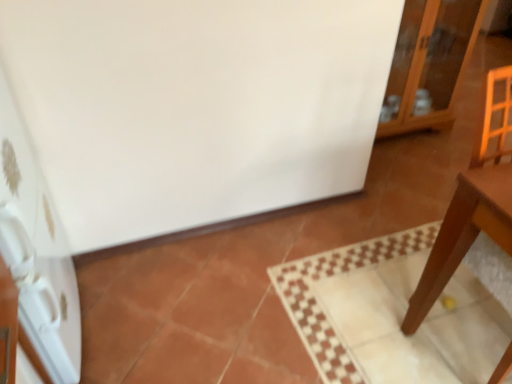
Image resolution: width=512 pixels, height=384 pixels. Describe the element at coordinates (37, 251) in the screenshot. I see `white glossy refrigerator at left` at that location.

The width and height of the screenshot is (512, 384). Identify the location of white glossy refrigerator at left. (37, 251).

In order to face white glossy refrigerator at left, should I rotate leftwards or rightwards?

To face it directly, rotate left by 30.622 degrees.

This screenshot has width=512, height=384. Describe the element at coordinates (429, 64) in the screenshot. I see `glossy wood cabinet at upper right` at that location.

This screenshot has height=384, width=512. In order to click on glossy wood cabinet at upper right in this screenshot , I will do `click(429, 64)`.

Image resolution: width=512 pixels, height=384 pixels. Identify the location of white glossy refrigerator at left. (37, 251).

In the image, is glossy wood cabinet at upper right on the left side or the right side of white glossy refrigerator at left?

Clearly, glossy wood cabinet at upper right is on the right of white glossy refrigerator at left in the image.

Considering the relative positions of glossy wood cabinet at upper right and white glossy refrigerator at left in the image provided, is glossy wood cabinet at upper right in front of white glossy refrigerator at left?

No.

Which is in front, point (446, 95) or point (36, 328)?

The point (36, 328) is more forward.

From the image's perspective, would you say glossy wood cabinet at upper right is shown under white glossy refrigerator at left?

No, from the image's perspective, glossy wood cabinet at upper right is not below white glossy refrigerator at left.

From a real-world perspective, is glossy wood cabinet at upper right under white glossy refrigerator at left?

Yes, from a real-world perspective, glossy wood cabinet at upper right is under white glossy refrigerator at left.

Consider the image. Considering the sizes of objects glossy wood cabinet at upper right and white glossy refrigerator at left in the image provided, who is thinner, glossy wood cabinet at upper right or white glossy refrigerator at left?

white glossy refrigerator at left.

Between glossy wood cabinet at upper right and white glossy refrigerator at left, which one has more height?

white glossy refrigerator at left.

Which of these two, glossy wood cabinet at upper right or white glossy refrigerator at left, is smaller?

glossy wood cabinet at upper right.

Would you say glossy wood cabinet at upper right is outside white glossy refrigerator at left?

glossy wood cabinet at upper right is positioned outside white glossy refrigerator at left.

Is there a large distance between glossy wood cabinet at upper right and white glossy refrigerator at left?

glossy wood cabinet at upper right is far away from white glossy refrigerator at left.

Is glossy wood cabinet at upper right aimed at white glossy refrigerator at left?

No, glossy wood cabinet at upper right is not turned towards white glossy refrigerator at left.

How different are the orientations of glossy wood cabinet at upper right and white glossy refrigerator at left in degrees?

glossy wood cabinet at upper right and white glossy refrigerator at left are facing 90 degrees away from each other.

The width and height of the screenshot is (512, 384). I want to click on appliance in front of the glossy wood cabinet at upper right, so coord(37,251).

Considering the positions of objects white glossy refrigerator at left and glossy wood cabinet at upper right in the image provided, who is more to the right, white glossy refrigerator at left or glossy wood cabinet at upper right?

Positioned to the right is glossy wood cabinet at upper right.

Considering the positions of objects white glossy refrigerator at left and glossy wood cabinet at upper right in the image provided, who is behind, white glossy refrigerator at left or glossy wood cabinet at upper right?

glossy wood cabinet at upper right is behind.

Which is nearer, (24, 150) or (461, 13)?

Point (24, 150) is closer to the camera than point (461, 13).

From the image's perspective, is white glossy refrigerator at left located above glossy wood cabinet at upper right?

No, from the image's perspective, white glossy refrigerator at left is not over glossy wood cabinet at upper right.

From a real-world perspective, is white glossy refrigerator at left on glossy wood cabinet at upper right?

Yes, from a real-world perspective, white glossy refrigerator at left is over glossy wood cabinet at upper right

Considering the relative sizes of white glossy refrigerator at left and glossy wood cabinet at upper right in the image provided, is white glossy refrigerator at left wider than glossy wood cabinet at upper right?

No, white glossy refrigerator at left is not wider than glossy wood cabinet at upper right.

In terms of height, does white glossy refrigerator at left look taller or shorter compared to glossy wood cabinet at upper right?

In the image, white glossy refrigerator at left appears to be taller than glossy wood cabinet at upper right.

Considering the sizes of objects white glossy refrigerator at left and glossy wood cabinet at upper right in the image provided, who is smaller, white glossy refrigerator at left or glossy wood cabinet at upper right?

glossy wood cabinet at upper right.

Is glossy wood cabinet at upper right surrounded by white glossy refrigerator at left?

Definitely not — glossy wood cabinet at upper right is not inside white glossy refrigerator at left.

From the picture: Is white glossy refrigerator at left touching glossy wood cabinet at upper right?

No, white glossy refrigerator at left is not with glossy wood cabinet at upper right.

Is white glossy refrigerator at left looking in the opposite direction of glossy wood cabinet at upper right?

white glossy refrigerator at left does not have its back to glossy wood cabinet at upper right.

Locate an element on the screen. The height and width of the screenshot is (384, 512). appliance below the glossy wood cabinet at upper right (from the image's perspective) is located at coordinates (37, 251).

This screenshot has width=512, height=384. I want to click on cabinetry on the right of white glossy refrigerator at left, so click(x=429, y=64).

At what (x,y) coordinates should I click in order to perform the action: click on cabinetry below the white glossy refrigerator at left (from a real-world perspective). Please return your answer as a coordinate pair (x, y). This screenshot has width=512, height=384. Looking at the image, I should click on (429, 64).